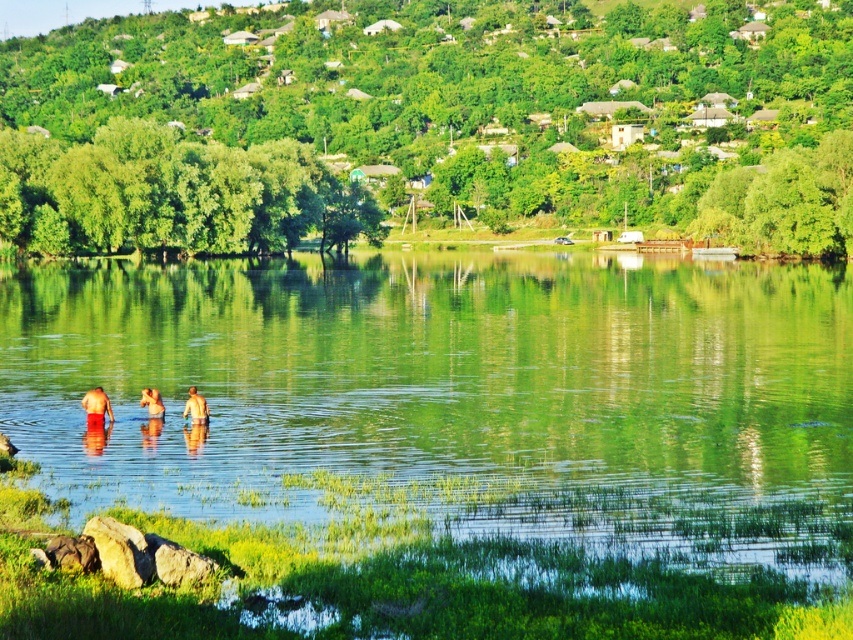
Who is positioned more to the left, green leafy hillside at upper center or skinny man at center?

skinny man at center is more to the left.

Is green leafy hillside at upper center further to the viewer compared to skinny man at center?

Yes, it is behind skinny man at center.

You are a GUI agent. You are given a task and a screenshot of the screen. Output one action in this format:
    pyautogui.click(x=<x>, y=<y>)
    Task: Click on the green leafy hillside at upper center
    
    Given the screenshot: What is the action you would take?
    pyautogui.click(x=428, y=120)

Which is behind, point (196, 420) or point (155, 401)?

Point (155, 401)

Does skinny man at center appear over smooth skin person at lower center?

No, skinny man at center is not above smooth skin person at lower center.

Who is more distant from viewer, (202, 412) or (148, 406)?

Point (148, 406)

Identify the location of skinny man at center. The width and height of the screenshot is (853, 640). (195, 406).

Does red matte shorts at lower left have a smaller size compared to smooth skin person at lower center?

No, red matte shorts at lower left is not smaller than smooth skin person at lower center.

Is red matte shorts at lower left to the left of smooth skin person at lower center from the viewer's perspective?

Yes, red matte shorts at lower left is to the left of smooth skin person at lower center.

Find the location of `red matte shorts at lower left`. red matte shorts at lower left is located at coordinates pos(96,406).